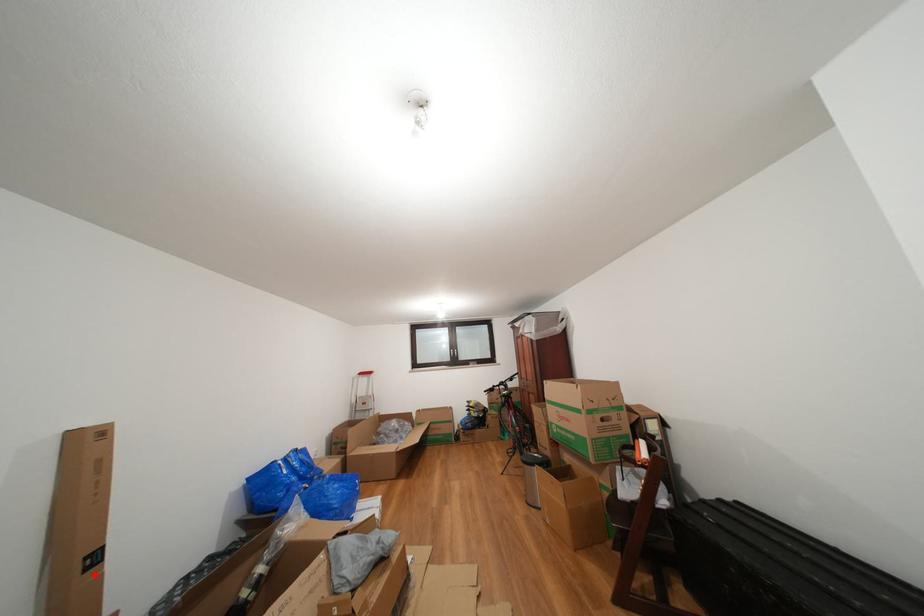
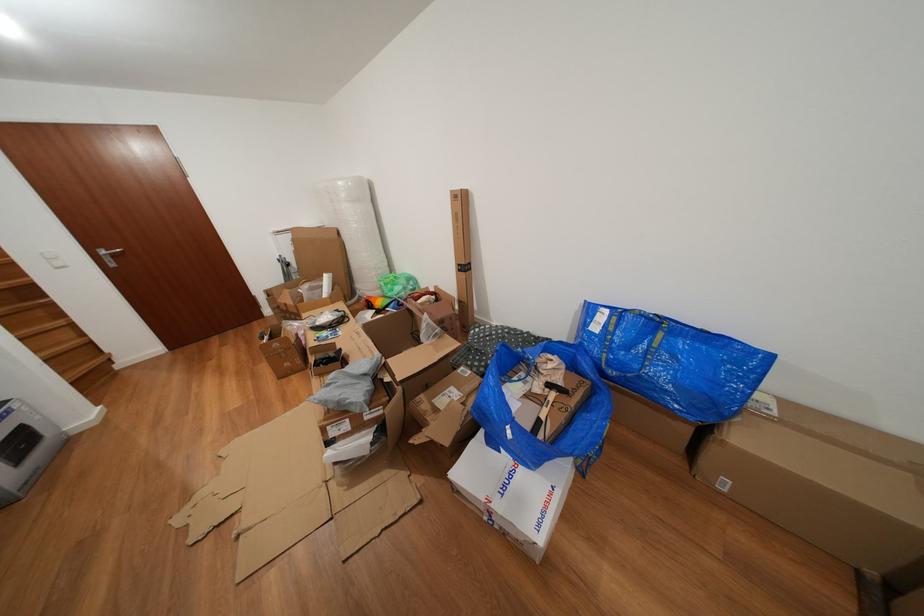
Where in the second image is the point corresponding to the highlighted location from the first image?

(468, 276)